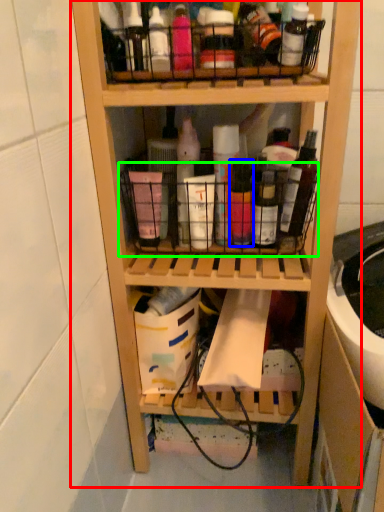
Question: Considering the real-world distances, which object is closest to shelf (highlighted by a red box)? bottle (highlighted by a blue box) or basket (highlighted by a green box).

Choices:
 (A) bottle
 (B) basket

Answer: (B)